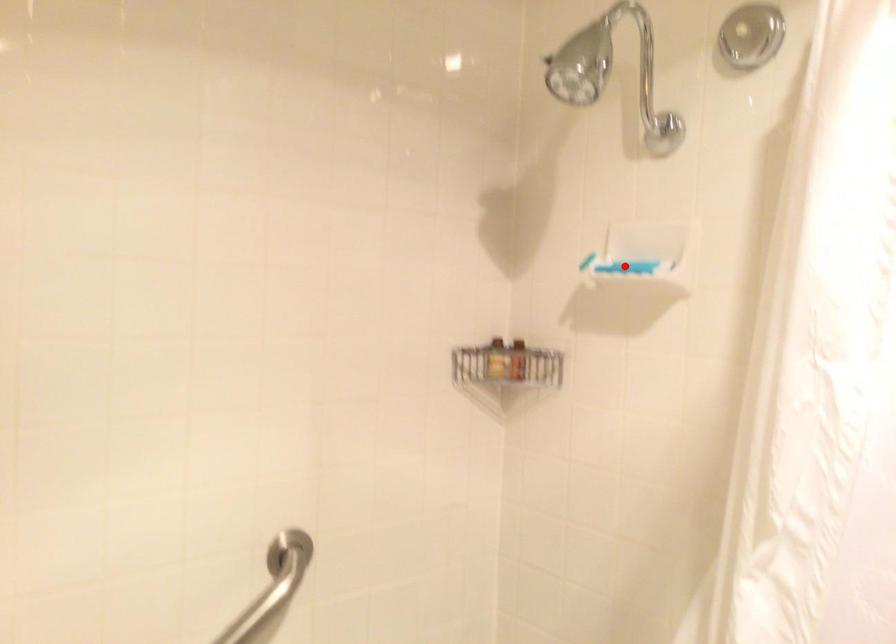
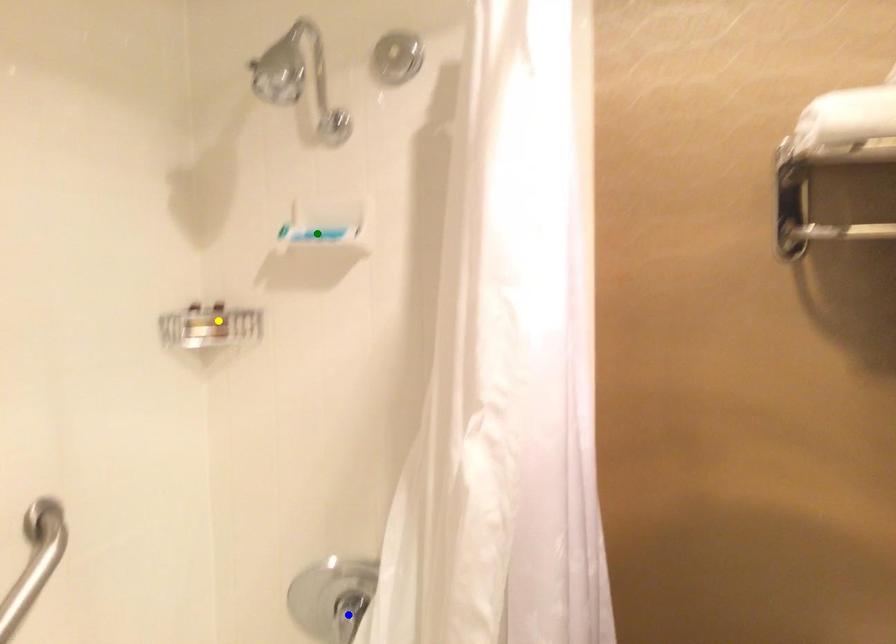
Question: I am providing you with two images of the same scene from different viewpoints. A red point is marked on the first image. You are given multiple points on the second image. In image 2, which mark is for the same physical point as the one in image 1?

Choices:
 (A) blue point
 (B) yellow point
 (C) green point

Answer: (C)